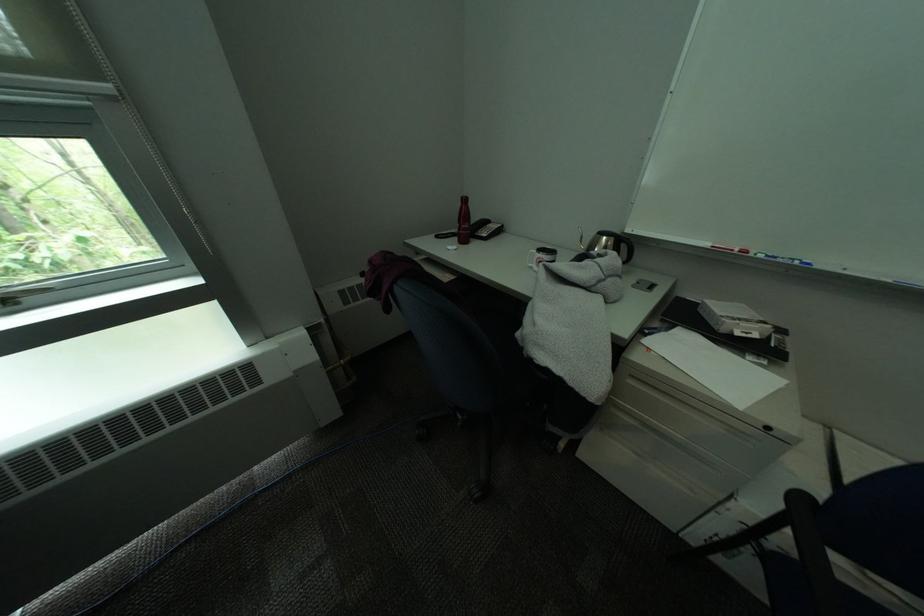
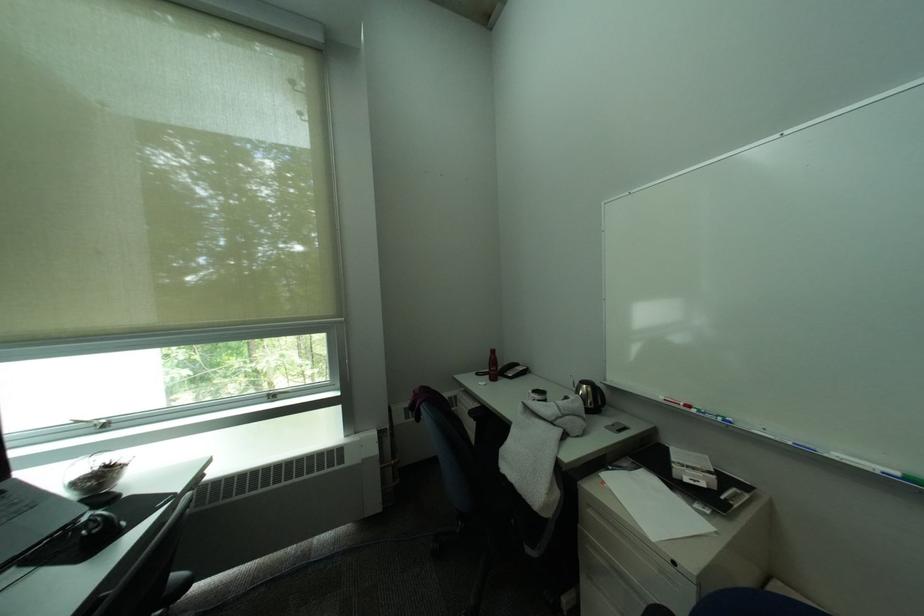
Locate, in the second image, the point that corresponds to the point at 791,262 in the first image.

(719, 416)